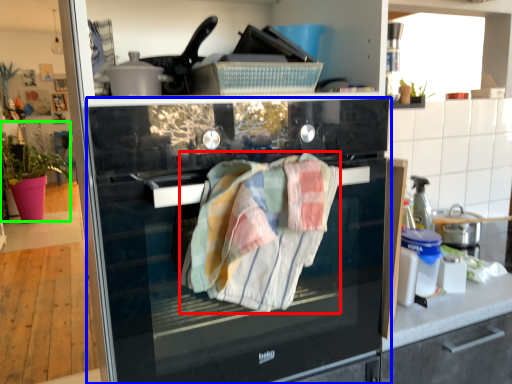
Question: Which is nearer to the bath towel (highlighted by a red box)? home appliance (highlighted by a blue box) or plant (highlighted by a green box).

Choices:
 (A) home appliance
 (B) plant

Answer: (A)